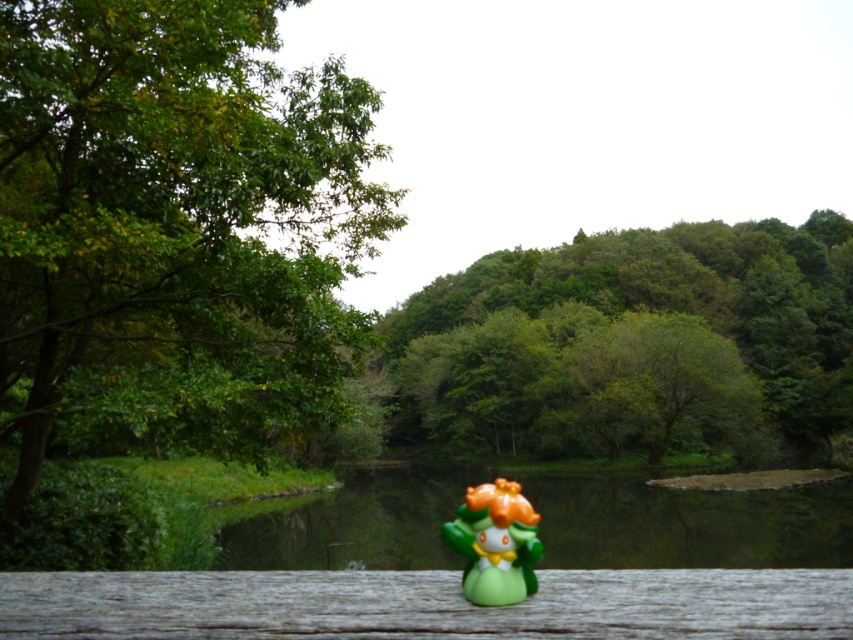
Question: Which of these objects is positioned farthest from the green matte figurine at center?

Choices:
 (A) green matte tree at center
 (B) green leafy tree at left

Answer: (A)

Question: Is green leafy trees at center positioned behind green glossy river at center?

Choices:
 (A) yes
 (B) no

Answer: (A)

Question: Does green glossy river at center appear over green matte figurine at center?

Choices:
 (A) no
 (B) yes

Answer: (A)

Question: Does green glossy river at center appear on the right side of green matte figurine at center?

Choices:
 (A) no
 (B) yes

Answer: (B)

Question: Which object is the farthest from the green glossy river at center?

Choices:
 (A) green matte tree at center
 (B) green leafy tree at left
 (C) green matte figurine at center

Answer: (C)

Question: Estimate the real-world distances between objects in this image. Which object is farther from the green matte tree at center?

Choices:
 (A) green leafy trees at center
 (B) green leafy tree at left
 (C) green glossy river at center

Answer: (B)